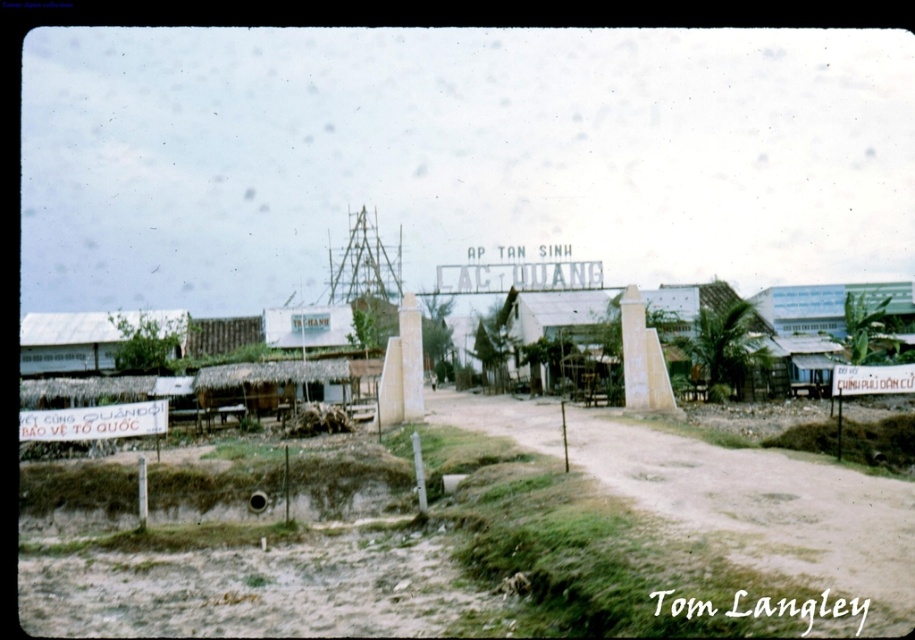
You are a hiker trying to find the dirt track to reach the settlement. You see the green grassy field at lower left and the brown sandy dirt track at center. Which object is located higher up in the image?

The green grassy field at lower left is above the brown sandy dirt track at center, so it is located higher up in the image.

You are a hiker planning to cross the green grassy field at lower left and the brown sandy dirt track at center. Which path would you choose if you want to avoid getting your shoes dirty?

The green grassy field at lower left is taller than the brown sandy dirt track at center, so choosing the green grassy field at lower left would be better to avoid getting your shoes dirty because the grass is taller and might cover the dirt.